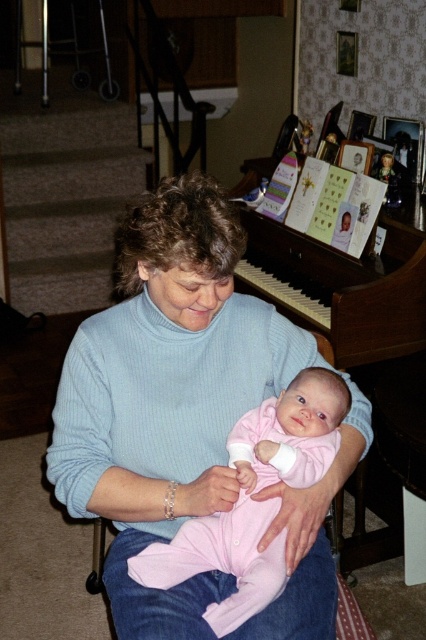
Question: Is pink matte onesie at center positioned before wooden piano at upper center?

Choices:
 (A) yes
 (B) no

Answer: (A)

Question: Can you confirm if pink matte onesie at center is wider than wooden piano at upper center?

Choices:
 (A) yes
 (B) no

Answer: (B)

Question: Can you confirm if light blue sweater at center is positioned below pink matte onesie at center?

Choices:
 (A) yes
 (B) no

Answer: (B)

Question: Considering the real-world distances, which object is farthest from the light blue sweater at center?

Choices:
 (A) pink matte onesie at center
 (B) wooden piano at upper center

Answer: (B)

Question: Which object is positioned closest to the light blue sweater at center?

Choices:
 (A) wooden piano at upper center
 (B) pink matte onesie at center

Answer: (B)

Question: Which of these objects is positioned closest to the wooden piano at upper center?

Choices:
 (A) light blue sweater at center
 (B) pink matte onesie at center

Answer: (A)